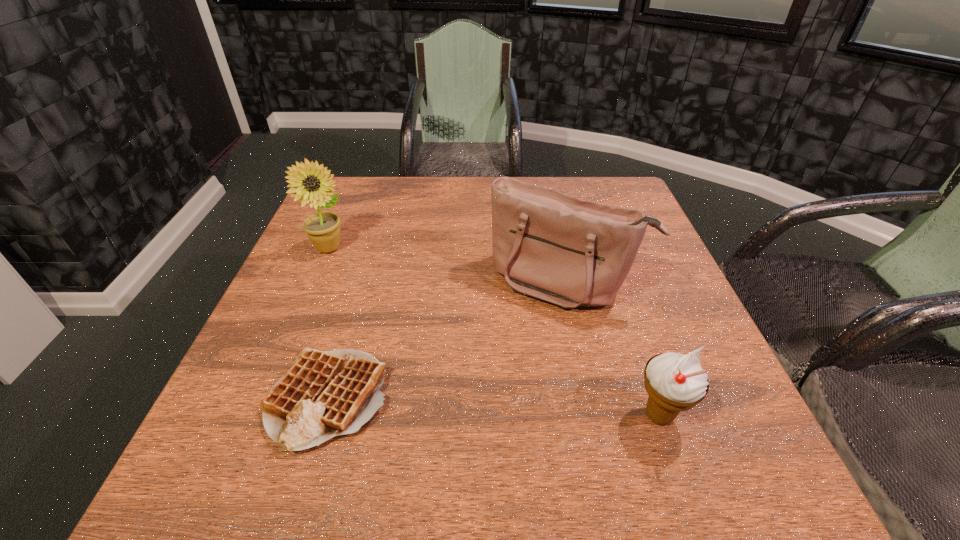
The height and width of the screenshot is (540, 960). In the image, there is a desktop. Find the location of `vacant space at the far edge`. vacant space at the far edge is located at coordinates (479, 187).

Find the location of a particular element. The image size is (960, 540). vacant space at the near edge of the desktop is located at coordinates (464, 421).

Identify the location of vacant space at the left edge of the desktop. (232, 376).

This screenshot has height=540, width=960. I want to click on vacant space at the right edge, so pos(682,326).

Where is `vacant space at the far left corner`? Image resolution: width=960 pixels, height=540 pixels. vacant space at the far left corner is located at coordinates click(347, 197).

Find the location of a particular element. The width and height of the screenshot is (960, 540). empty location between the second shortest object and the shoulder bag is located at coordinates point(611,348).

Where is `vacant area that lies between the shortest object and the second shortest object`? Image resolution: width=960 pixels, height=540 pixels. vacant area that lies between the shortest object and the second shortest object is located at coordinates (493, 407).

I want to click on vacant space that is in between the sunflower and the shortest object, so click(x=329, y=323).

Find the location of a particular element. This screenshot has width=960, height=540. vacant space in between the sunflower and the third tallest object is located at coordinates (494, 332).

Identify the location of vacant area that lies between the icecream and the shortest object. (493, 407).